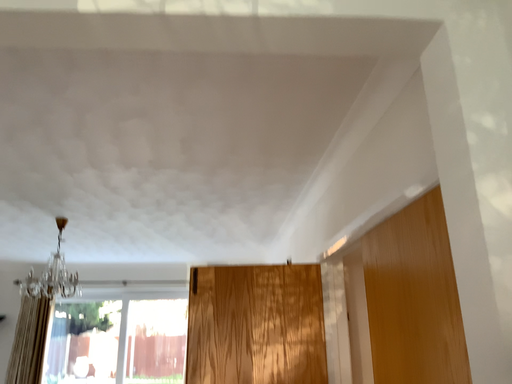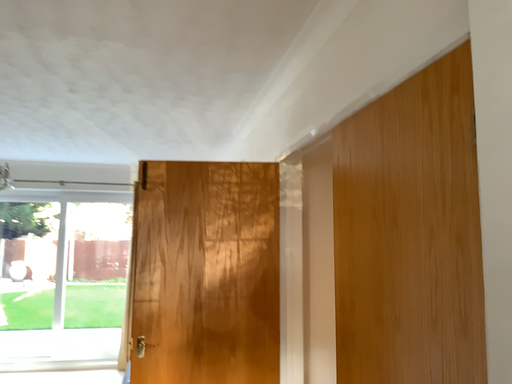
Question: How did the camera likely rotate when shooting the video?

Choices:
 (A) rotated upward
 (B) rotated downward

Answer: (B)